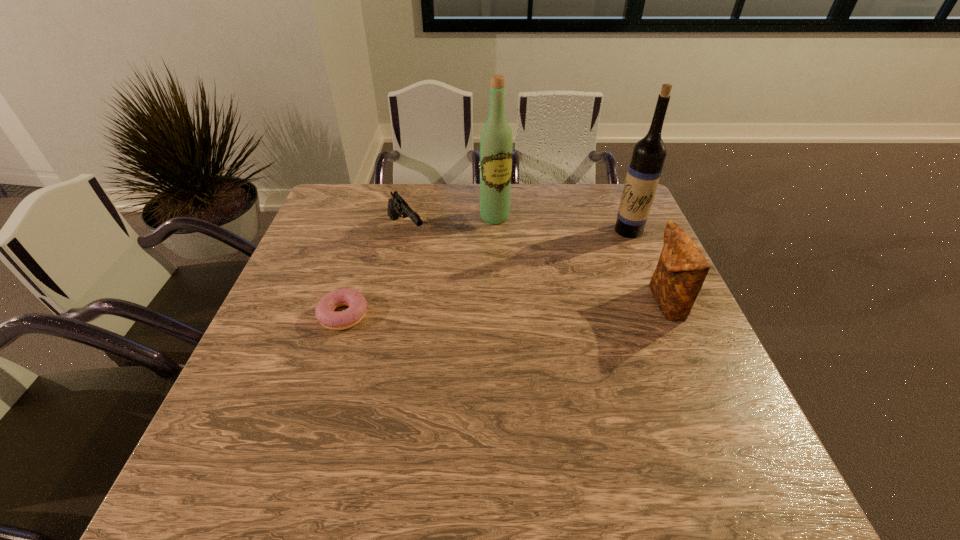
Locate an element on the screen. the shortest object is located at coordinates (325, 314).

Find the location of a particular element. The image size is (960, 540). clutch bag is located at coordinates 682,268.

The width and height of the screenshot is (960, 540). Identify the location of the fourth tallest object. (397, 207).

Identify the location of the left wine bottle. This screenshot has height=540, width=960. (496, 139).

What are the coordinates of `the right wine bottle` in the screenshot? It's located at (648, 156).

In order to click on vacant space situated on the back of the shortest object in this screenshot , I will do `click(358, 268)`.

Identify the location of free space located on the open side of the clutch bag. (547, 303).

The width and height of the screenshot is (960, 540). Identify the location of free space located on the open side of the clutch bag. tap(499, 303).

Where is `vacant area situated 0.230m on the open side of the clutch bag`? The width and height of the screenshot is (960, 540). vacant area situated 0.230m on the open side of the clutch bag is located at coordinates (556, 303).

Image resolution: width=960 pixels, height=540 pixels. I want to click on vacant space located 0.190m at the end of the barrel of the gun, so click(447, 287).